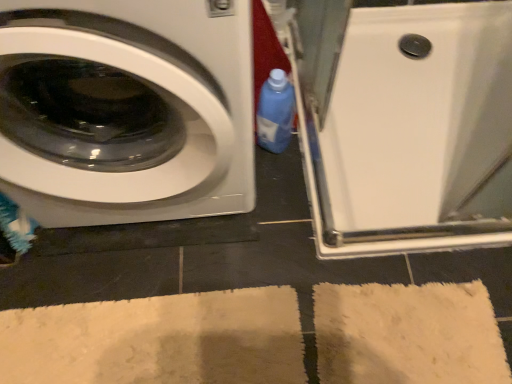
Question: Considering the positions of white glossy washing machine at left and beige soft rug at lower center in the image, is white glossy washing machine at left taller or shorter than beige soft rug at lower center?

Choices:
 (A) short
 (B) tall

Answer: (B)

Question: From a real-world perspective, is white glossy washing machine at left above or below beige soft rug at lower center?

Choices:
 (A) below
 (B) above

Answer: (B)

Question: Considering the real-world distances, which object is closest to the white glossy shower tray at upper right?

Choices:
 (A) beige soft rug at lower center
 (B) blue plastic bottle at center
 (C) white glossy washing machine at left

Answer: (B)

Question: Considering the real-world distances, which object is closest to the white glossy washing machine at left?

Choices:
 (A) beige soft rug at lower center
 (B) white glossy shower tray at upper right
 (C) blue plastic bottle at center

Answer: (C)